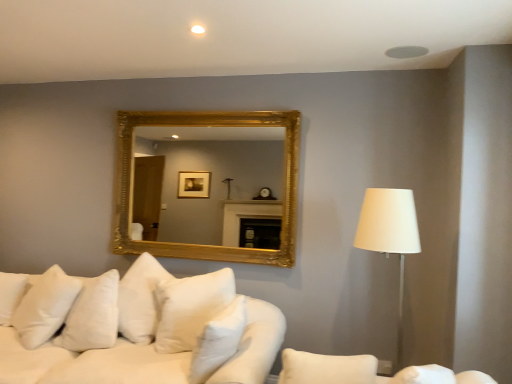
Question: From the image's perspective, is white fabric lampshade at right above or below white soft cushions at lower left?

Choices:
 (A) below
 (B) above

Answer: (B)

Question: Considering the positions of point click(x=385, y=215) and point click(x=118, y=349), is point click(x=385, y=215) closer or farther from the camera than point click(x=118, y=349)?

Choices:
 (A) closer
 (B) farther

Answer: (A)

Question: Which object is the farthest from the white fabric couch at lower right?

Choices:
 (A) white soft cushions at lower left
 (B) white soft pillow at center, placed as the 1th pillow when sorted from front to back
 (C) white soft pillow at lower left, the 1th pillow from the back
 (D) gold/gilded mirror at upper center
 (E) white fabric lampshade at right

Answer: (D)

Question: Considering the real-world distances, which object is closest to the gold/gilded mirror at upper center?

Choices:
 (A) white fabric couch at lower right
 (B) white fabric lampshade at right
 (C) white soft cushions at lower left
 (D) white soft pillow at lower left, the second pillow in the right-to-left sequence
 (E) white soft pillow at center, placed as the 1th pillow when sorted from front to back

Answer: (C)